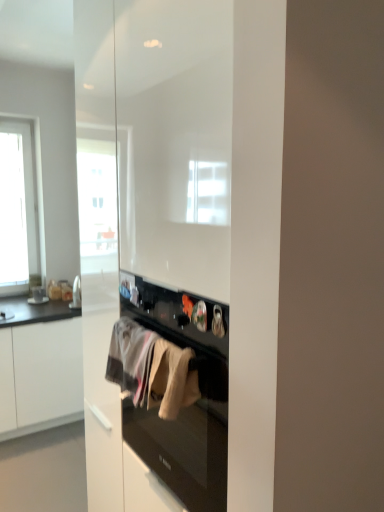
Question: Does white matte cabinet at left turn towards white cotton towel at center, marked as the second clothing in a right-to-left arrangement?

Choices:
 (A) yes
 (B) no

Answer: (A)

Question: Is white cotton towel at center, the first clothing in the left-to-right sequence, completely or partially inside white matte cabinet at left?

Choices:
 (A) yes
 (B) no

Answer: (B)

Question: Can you confirm if white matte cabinet at left is taller than white cotton towel at center, marked as the second clothing in a right-to-left arrangement?

Choices:
 (A) yes
 (B) no

Answer: (A)

Question: Is white matte cabinet at left positioned far away from white cotton towel at center, which is the 1th clothing from back to front?

Choices:
 (A) no
 (B) yes

Answer: (B)

Question: Does white matte cabinet at left appear on the left side of white cotton towel at center, the first clothing in the left-to-right sequence?

Choices:
 (A) no
 (B) yes

Answer: (B)

Question: Is white matte cabinet at left outside of white cotton towel at center, placed as the 2th clothing when sorted from front to back?

Choices:
 (A) no
 (B) yes

Answer: (B)

Question: Is white cotton towel at center, which is the 1th clothing from back to front, taller than white cotton towel at center, which is the first clothing from front to back?

Choices:
 (A) no
 (B) yes

Answer: (B)

Question: Is white cotton towel at center, which is the 1th clothing from back to front, placed right next to white cotton towel at center, which is the first clothing from front to back?

Choices:
 (A) no
 (B) yes

Answer: (A)

Question: Considering the relative positions of white cotton towel at center, placed as the 2th clothing when sorted from front to back, and white cotton towel at center, the 1th clothing when ordered from right to left, in the image provided, is white cotton towel at center, placed as the 2th clothing when sorted from front to back, to the left of white cotton towel at center, the 1th clothing when ordered from right to left, from the viewer's perspective?

Choices:
 (A) no
 (B) yes

Answer: (B)

Question: Could white cotton towel at center, the 1th clothing when ordered from right to left, be considered to be inside white cotton towel at center, marked as the second clothing in a right-to-left arrangement?

Choices:
 (A) no
 (B) yes

Answer: (A)

Question: Is white cotton towel at center, the first clothing in the left-to-right sequence, positioned with its back to white cotton towel at center, the 2th clothing in the back-to-front sequence?

Choices:
 (A) yes
 (B) no

Answer: (B)

Question: From the image's perspective, is white cotton towel at center, the first clothing in the left-to-right sequence, beneath white cotton towel at center, placed as the 2th clothing when sorted from left to right?

Choices:
 (A) yes
 (B) no

Answer: (A)

Question: Is white matte cabinet at left surrounded by white cotton towel at center, placed as the 2th clothing when sorted from front to back?

Choices:
 (A) no
 (B) yes

Answer: (A)